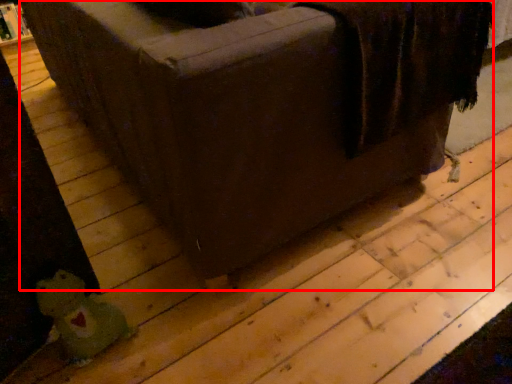
Question: From the image, what is the correct spatial relationship of furniture (annotated by the red box) in relation to toy?

Choices:
 (A) left
 (B) right

Answer: (B)